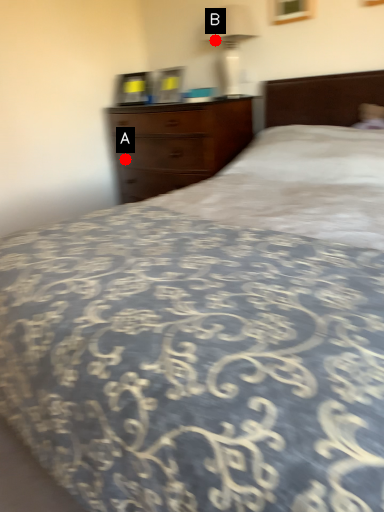
Question: Two points are circled on the image, labeled by A and B beside each circle. Which point is closer to the camera taking this photo?

Choices:
 (A) A is closer
 (B) B is closer

Answer: (B)